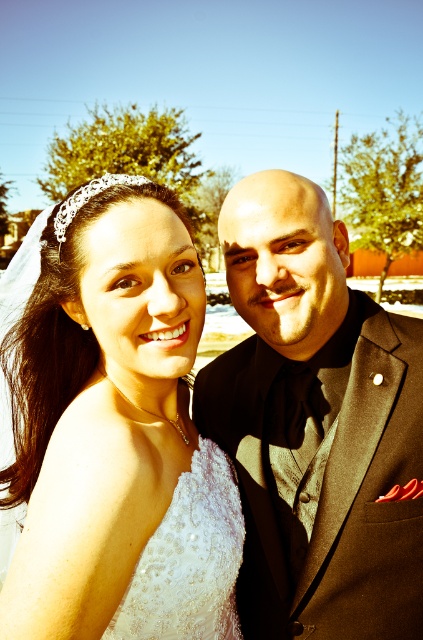
Question: Is white satin dress at center bigger than ivory lace dress at center?

Choices:
 (A) no
 (B) yes

Answer: (B)

Question: Among these points, which one is farthest from the camera?

Choices:
 (A) (148, 636)
 (B) (175, 362)
 (C) (269, 580)

Answer: (C)

Question: Can you confirm if black satin suit at right is bigger than ivory lace dress at center?

Choices:
 (A) yes
 (B) no

Answer: (A)

Question: Among these points, which one is farthest from the camera?

Choices:
 (A) (313, 269)
 (B) (189, 476)

Answer: (A)

Question: Considering the real-world distances, which object is closest to the white satin dress at center?

Choices:
 (A) black satin suit at right
 (B) ivory lace dress at center

Answer: (B)

Question: Can you confirm if white satin dress at center is thinner than black satin suit at right?

Choices:
 (A) yes
 (B) no

Answer: (B)